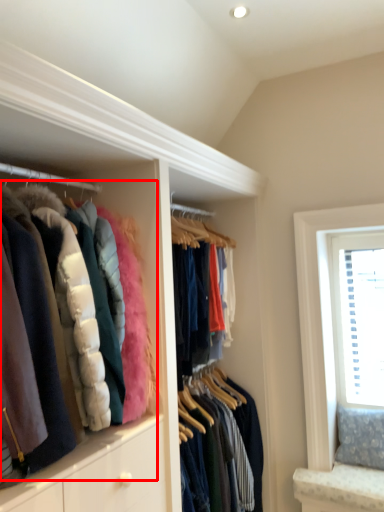
Question: From the image's perspective, considering the relative positions of jacket (annotated by the red box) and window in the image provided, where is jacket (annotated by the red box) located with respect to the staircase?

Choices:
 (A) above
 (B) below

Answer: (A)